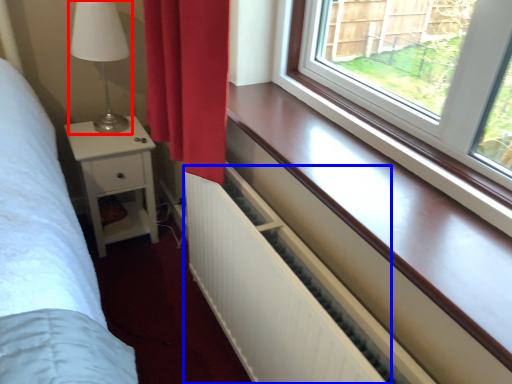
Question: Among these objects, which one is farthest to the camera, table lamp (highlighted by a red box) or radiator (highlighted by a blue box)?

Choices:
 (A) table lamp
 (B) radiator

Answer: (A)